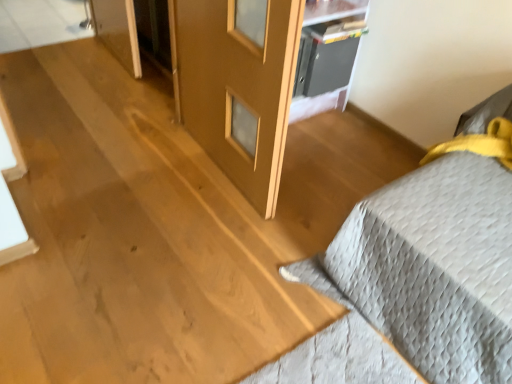
The height and width of the screenshot is (384, 512). I want to click on free space in front of matte wood screen door at center, so click(197, 243).